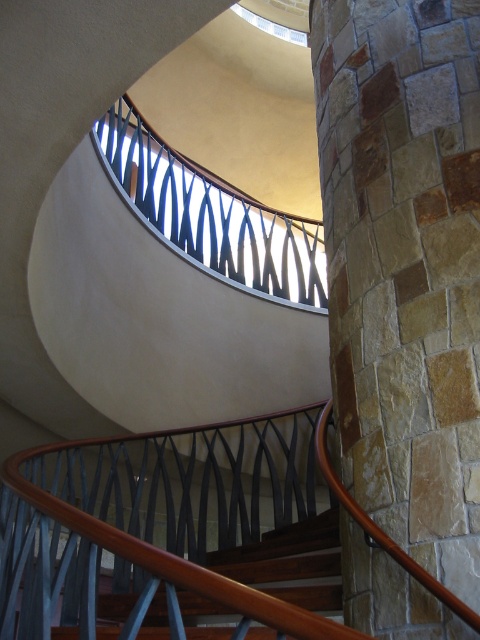
Question: Does natural stone pillar at right appear on the right side of metallic black railing at upper center?

Choices:
 (A) yes
 (B) no

Answer: (A)

Question: Can you confirm if natural stone pillar at right is smaller than metallic black railing at upper center?

Choices:
 (A) no
 (B) yes

Answer: (B)

Question: Does natural stone pillar at right lie behind metallic black railing at upper center?

Choices:
 (A) no
 (B) yes

Answer: (A)